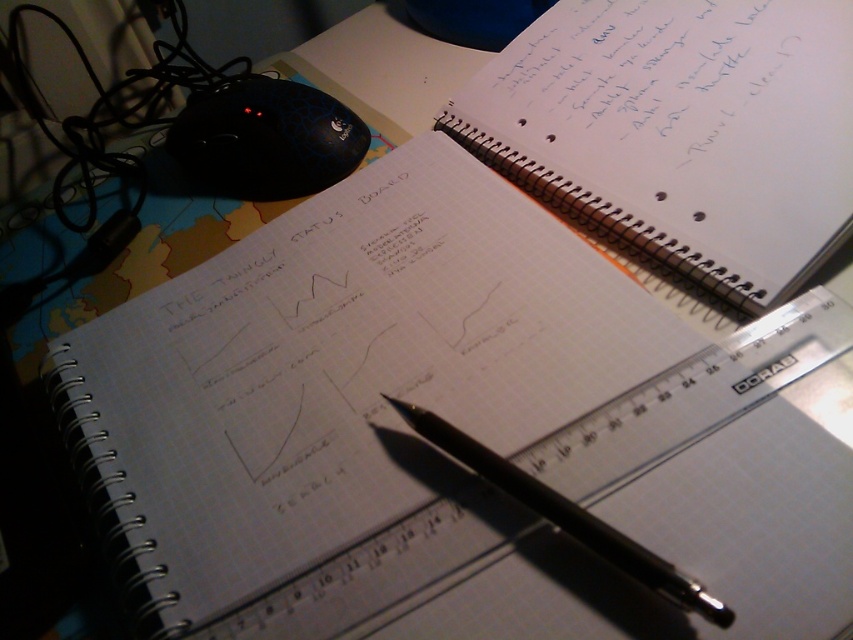
Question: Estimate the real-world distances between objects in this image. Which object is closer to the blue ink writing at upper right?

Choices:
 (A) black metallic pen at center
 (B) black textured mouse at upper left

Answer: (B)

Question: Among these objects, which one is nearest to the camera?

Choices:
 (A) black textured mouse at upper left
 (B) blue ink writing at upper right

Answer: (B)

Question: Which point appears closest to the camera in this image?

Choices:
 (A) (759, 54)
 (B) (828, 186)

Answer: (B)

Question: Is white paper at upper right thinner than blue ink writing at upper right?

Choices:
 (A) no
 (B) yes

Answer: (A)

Question: Can you confirm if white paper at upper right is bigger than black textured mouse at upper left?

Choices:
 (A) yes
 (B) no

Answer: (A)

Question: In this image, where is blue ink writing at upper right located relative to black textured mouse at upper left?

Choices:
 (A) below
 (B) above

Answer: (A)